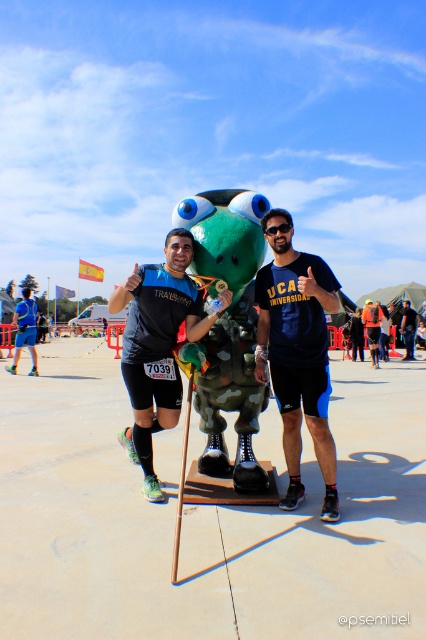
Based on the photo, is blue matte shirt at center in front of black matte shirt at center?

That is True.

Which is below, blue matte shirt at center or black matte shirt at center?

Positioned lower is black matte shirt at center.

Is point (313, 296) positioned before point (157, 280)?

Yes, point (313, 296) is closer to viewer.

At what (x,y) coordinates should I click in order to perform the action: click on blue matte shirt at center. Please return your answer as a coordinate pair (x, y). Looking at the image, I should click on (296, 352).